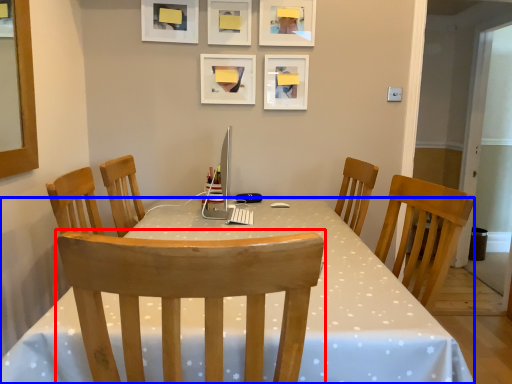
Question: Which object is further to the camera taking this photo, chair (highlighted by a red box) or desk (highlighted by a blue box)?

Choices:
 (A) chair
 (B) desk

Answer: (B)